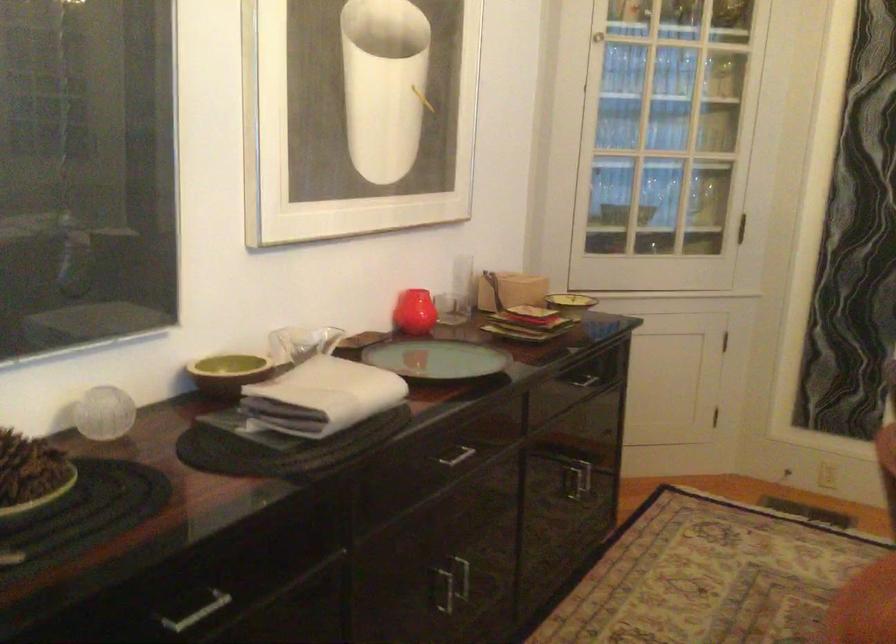
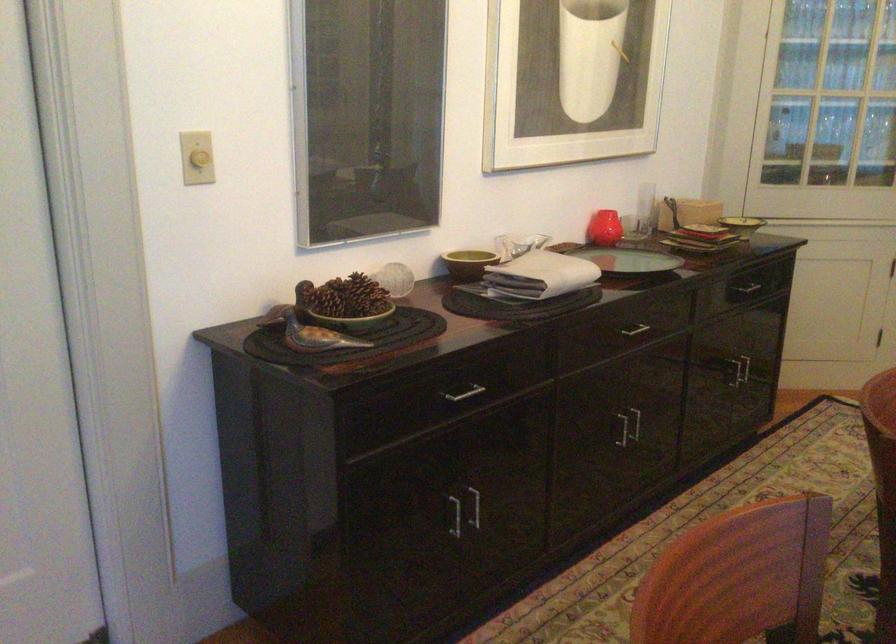
Locate, in the second image, the point that corresponds to pixel 454 572 in the first image.

(635, 422)